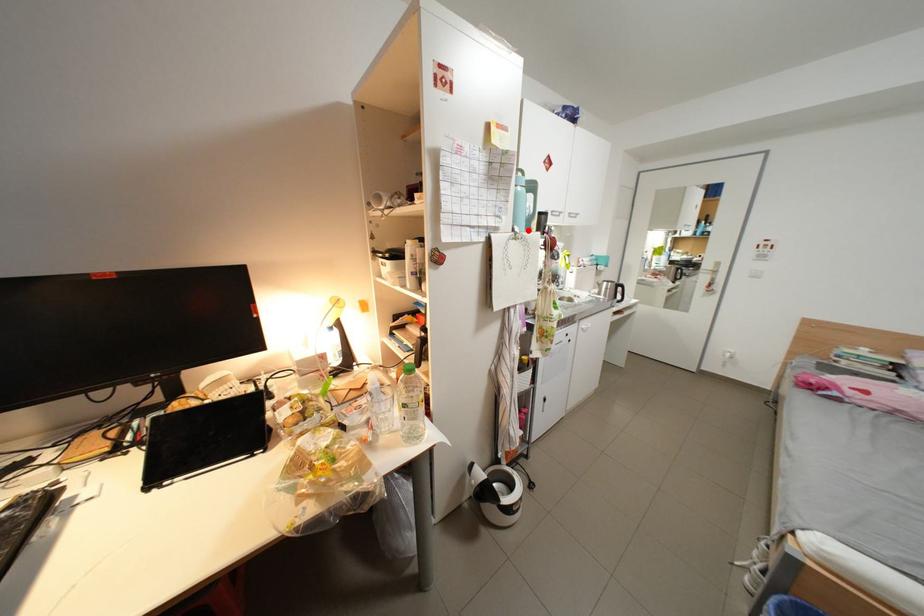
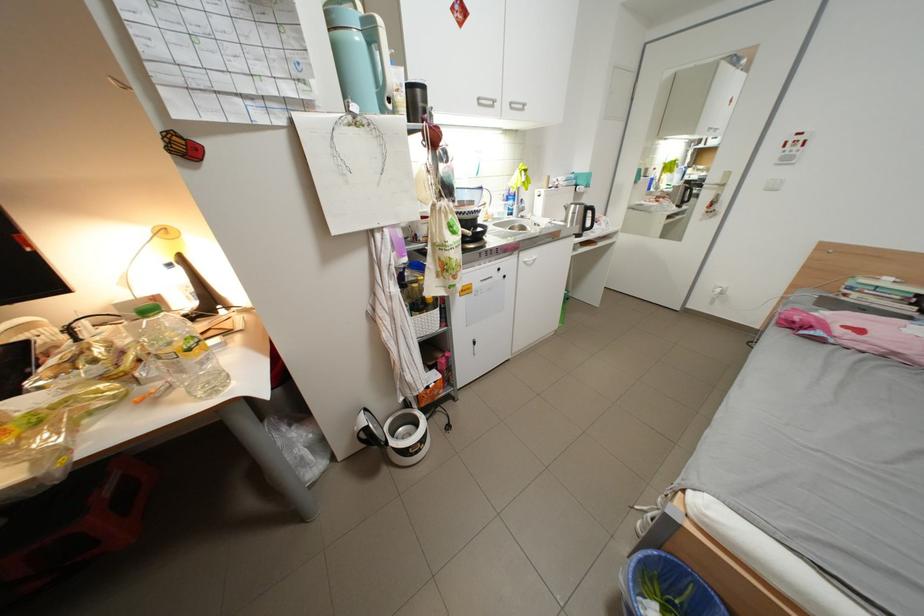
Where in the second image is the point corresponding to the highlighted location from the first image?

(367, 108)